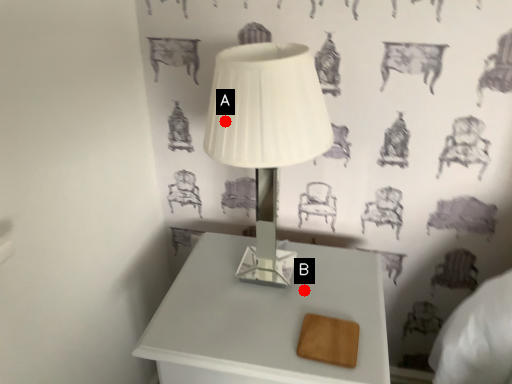
Question: Two points are circled on the image, labeled by A and B beside each circle. Among these points, which one is farthest from the camera?

Choices:
 (A) A is further
 (B) B is further

Answer: (B)